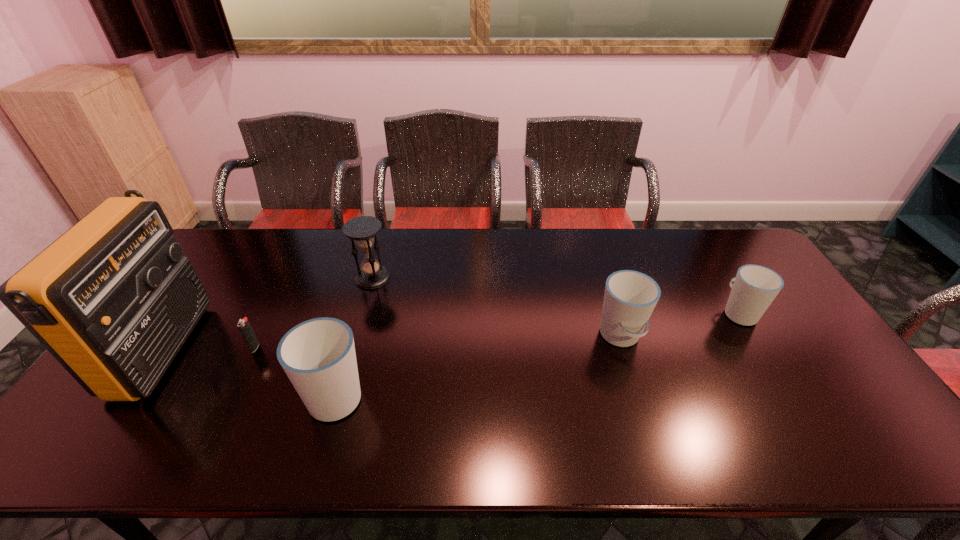
Identify the location of object that is the third closest to the tallest object. tap(362, 230).

Choose which object is the second nearest neighbor to the shortest object. Please provide its 2D coordinates. Your answer should be formatted as a tuple, i.e. [(x, y)], where the tuple contains the x and y coordinates of a point satisfying the conditions above.

[(318, 355)]

Select which cup is the closest to the hourglass. Please provide its 2D coordinates. Your answer should be formatted as a tuple, i.e. [(x, y)], where the tuple contains the x and y coordinates of a point satisfying the conditions above.

[(318, 355)]

Locate which cup is the second closest to the fifth object from left to right. Please provide its 2D coordinates. Your answer should be formatted as a tuple, i.e. [(x, y)], where the tuple contains the x and y coordinates of a point satisfying the conditions above.

[(318, 355)]

This screenshot has height=540, width=960. Find the location of `vacant space that satisfies the following two spatial constraints: 1. with a handle on the side of the farthest object; 2. on the left side of the leftmost cup`. vacant space that satisfies the following two spatial constraints: 1. with a handle on the side of the farthest object; 2. on the left side of the leftmost cup is located at coordinates (370, 278).

Where is `free location that satisfies the following two spatial constraints: 1. on the front side of the second object from left to right; 2. on the front-facing side of the radio receiver`? This screenshot has height=540, width=960. free location that satisfies the following two spatial constraints: 1. on the front side of the second object from left to right; 2. on the front-facing side of the radio receiver is located at coordinates (254, 350).

At what (x,y) coordinates should I click in order to perform the action: click on vacant region that satisfies the following two spatial constraints: 1. with a handle on the side of the leftmost cup; 2. on the right side of the farthest object. Please return your answer as a coordinate pair (x, y). The image size is (960, 540). Looking at the image, I should click on (370, 278).

Identify the location of free space that satisfies the following two spatial constraints: 1. with a handle on the side of the hourglass; 2. on the right side of the nearest cup. The width and height of the screenshot is (960, 540). (370, 278).